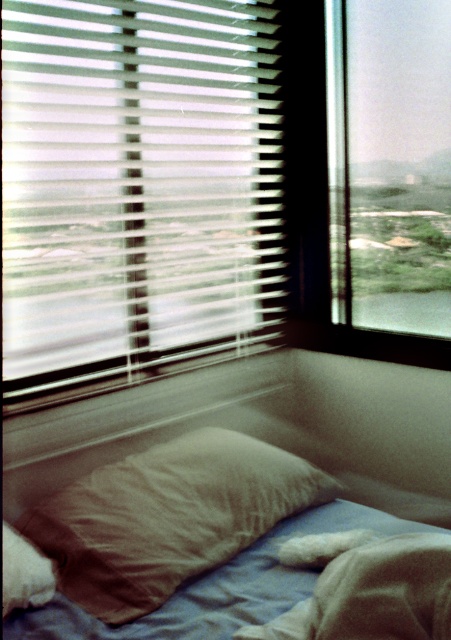
You are standing in the room and want to let more natural light into the space. Which object should you adjust to achieve this goal, the white translucent blinds at upper left or the transparent glass window at upper right?

You should adjust the white translucent blinds at upper left because it is located below the transparent glass window at upper right and can be adjusted to allow more light in without opening the window itself.

Consider the image. In the image of the bedroom corner with the bed near the window, where is the brown cotton pillow at center located in terms of coordinates?

The brown cotton pillow at center is located at coordinates point (168,516).

You are a window cleaner who needs to clean the white translucent blinds at upper left and the transparent glass window at upper right. The cleaning tool you have can only reach 20 inches. Can you clean both without moving the tool?

The white translucent blinds at upper left and transparent glass window at upper right are 22.46 inches apart, so the tool cannot reach both without moving since it only extends 20 inches.